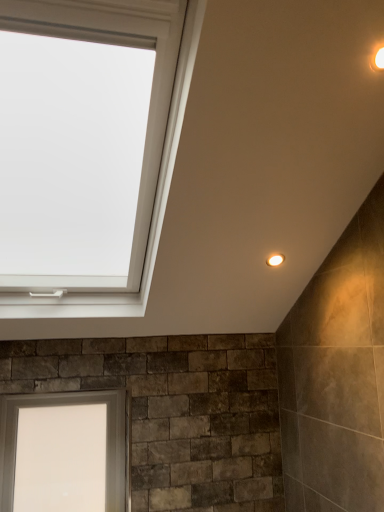
Question: Should I look upward or downward to see matte white light fixture at upper right, which is counted as the 1th light fixture, starting from the bottom?

Choices:
 (A) up
 (B) down

Answer: (B)

Question: From the image's perspective, is warm matte light fixture at upper right, the second light fixture from the left, beneath white glass window at lower left?

Choices:
 (A) yes
 (B) no

Answer: (B)

Question: Does warm matte light fixture at upper right, which is the 1th light fixture in front-to-back order, lie behind white glass window at lower left?

Choices:
 (A) yes
 (B) no

Answer: (B)

Question: From a real-world perspective, is warm matte light fixture at upper right, which is counted as the first light fixture, starting from the top, over white glass window at lower left?

Choices:
 (A) no
 (B) yes

Answer: (B)

Question: Can you confirm if warm matte light fixture at upper right, which is the 1th light fixture in front-to-back order, is positioned to the right of white glass window at lower left?

Choices:
 (A) yes
 (B) no

Answer: (A)

Question: Is warm matte light fixture at upper right, which is the first light fixture in right-to-left order, wider than white glass window at lower left?

Choices:
 (A) yes
 (B) no

Answer: (B)

Question: Considering the relative sizes of warm matte light fixture at upper right, which is the first light fixture in right-to-left order, and white glass window at lower left in the image provided, is warm matte light fixture at upper right, which is the first light fixture in right-to-left order, taller than white glass window at lower left?

Choices:
 (A) no
 (B) yes

Answer: (A)

Question: Could you tell me if white glass window at lower left is turned towards matte white light fixture at upper right, acting as the 2th light fixture starting from the right?

Choices:
 (A) yes
 (B) no

Answer: (B)

Question: Is matte white light fixture at upper right, the first light fixture viewed from the left, at the back of white glass window at lower left?

Choices:
 (A) no
 (B) yes

Answer: (A)

Question: Can you confirm if white glass window at lower left is shorter than matte white light fixture at upper right, which is counted as the 2th light fixture, starting from the front?

Choices:
 (A) no
 (B) yes

Answer: (A)

Question: Is white glass window at lower left smaller than matte white light fixture at upper right, which is counted as the 1th light fixture, starting from the bottom?

Choices:
 (A) no
 (B) yes

Answer: (A)

Question: Considering the relative positions of white glass window at lower left and matte white light fixture at upper right, the 2th light fixture from the top, in the image provided, is white glass window at lower left to the right of matte white light fixture at upper right, the 2th light fixture from the top, from the viewer's perspective?

Choices:
 (A) no
 (B) yes

Answer: (A)

Question: Is white glass window at lower left at the left side of matte white light fixture at upper right, the 2th light fixture from the top?

Choices:
 (A) no
 (B) yes

Answer: (B)

Question: Can you confirm if white glass window at lower left is shorter than warm matte light fixture at upper right, which is counted as the first light fixture, starting from the top?

Choices:
 (A) yes
 (B) no

Answer: (B)